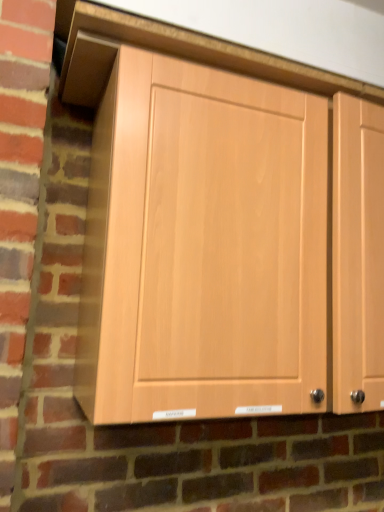
Describe the element at coordinates (203, 247) in the screenshot. I see `light wood cabinet at center` at that location.

The width and height of the screenshot is (384, 512). What are the coordinates of `light wood cabinet at center` in the screenshot? It's located at (203, 247).

Where is `light wood cabinet at center`? light wood cabinet at center is located at coordinates (203, 247).